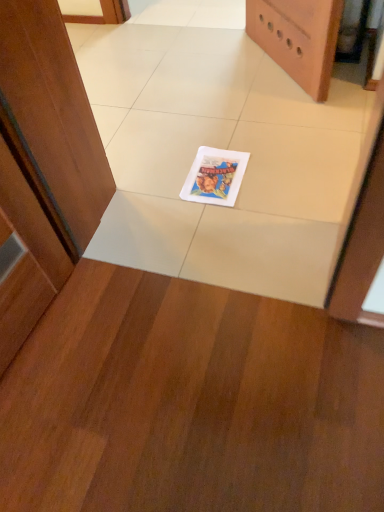
At what (x,y) coordinates should I click in order to perform the action: click on vacant space that is to the left of matte white comic book at center. Please return your answer as a coordinate pair (x, y). Looking at the image, I should click on (157, 181).